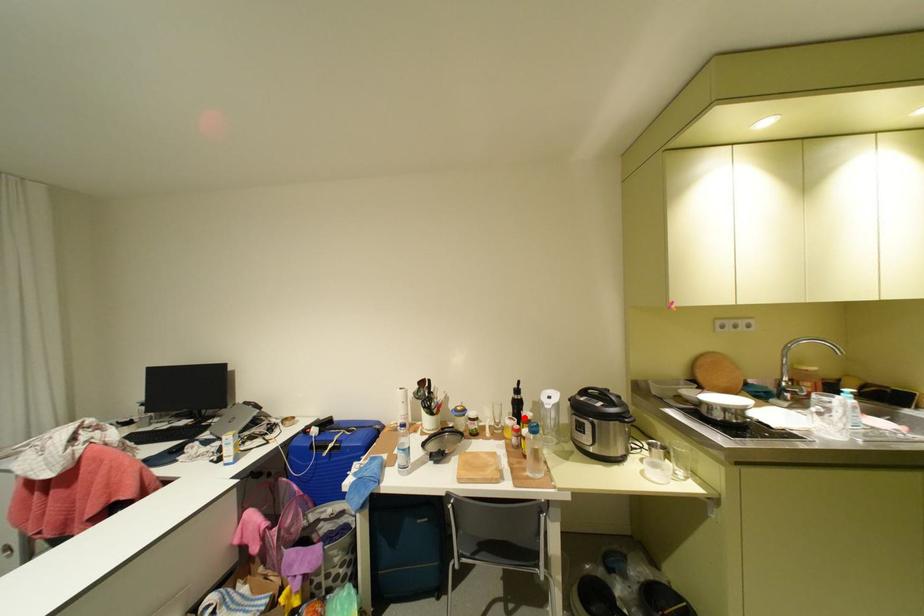
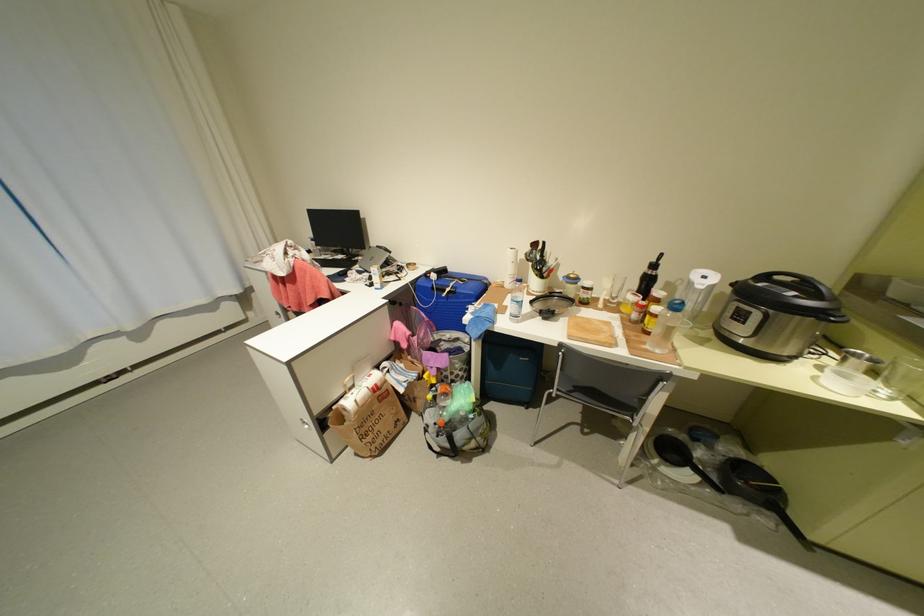
Where in the second image is the point corresponding to the highlighted location from the first image?

(649, 294)